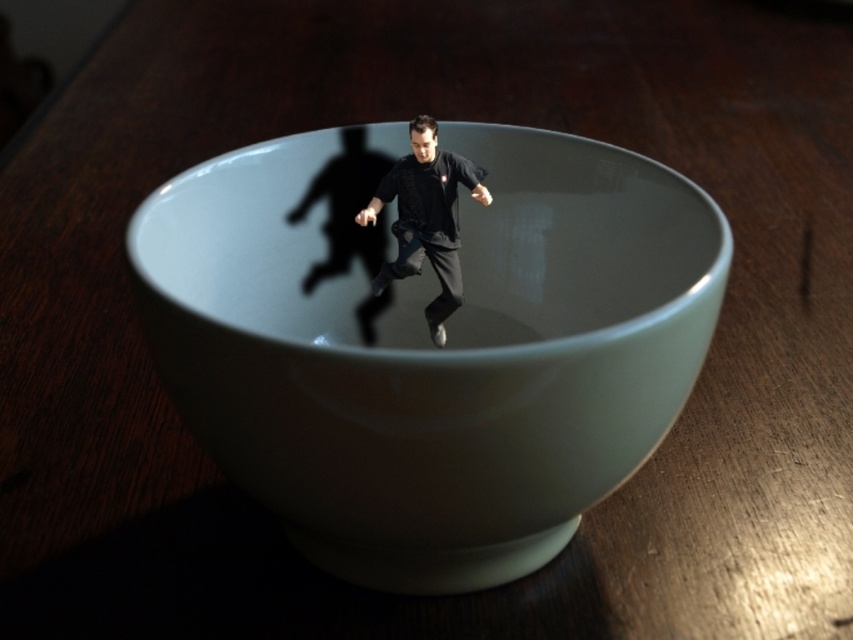
Question: Is white glossy bowl at center thinner than black matte shirt at center?

Choices:
 (A) no
 (B) yes

Answer: (A)

Question: Which of the following is the closest to the observer?

Choices:
 (A) (427, 154)
 (B) (241, 273)

Answer: (B)

Question: Does white glossy bowl at center appear on the left side of black matte shirt at center?

Choices:
 (A) yes
 (B) no

Answer: (B)

Question: Observing the image, what is the correct spatial positioning of white glossy bowl at center in reference to black matte shirt at center?

Choices:
 (A) above
 (B) below

Answer: (B)

Question: Among these points, which one is nearest to the camera?

Choices:
 (A) (424, 168)
 (B) (316, 388)

Answer: (B)

Question: Which point is farther from the camera taking this photo?

Choices:
 (A) (210, 307)
 (B) (381, 288)

Answer: (B)